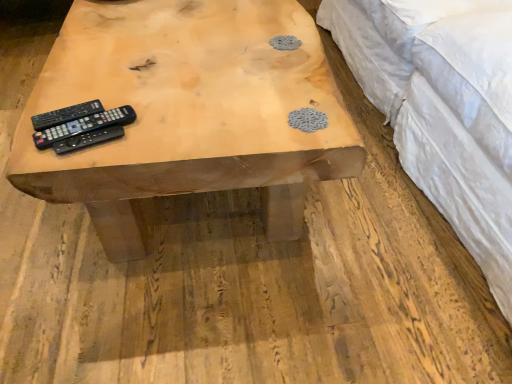
In order to click on vacant space to the right of black plastic remote at left, which ranks as the 2th remote control in back-to-front order in this screenshot , I will do `click(165, 117)`.